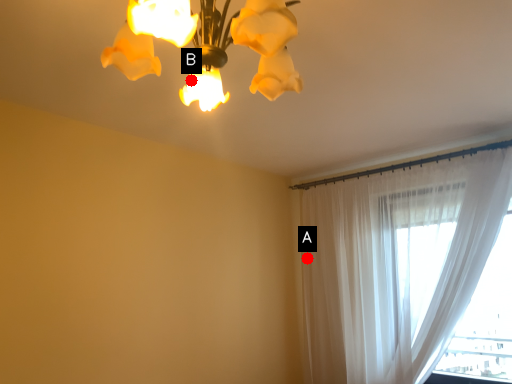
Question: Two points are circled on the image, labeled by A and B beside each circle. Which point is closer to the camera taking this photo?

Choices:
 (A) A is closer
 (B) B is closer

Answer: (B)